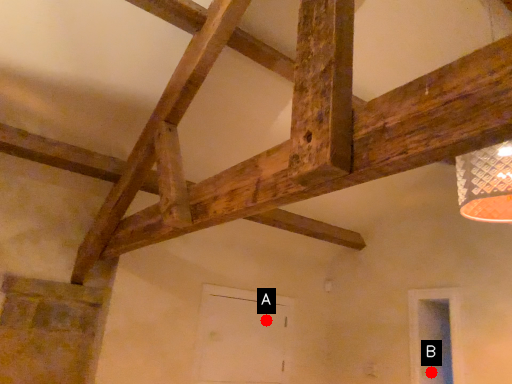
Question: Two points are circled on the image, labeled by A and B beside each circle. Among these points, which one is nearest to the camera?

Choices:
 (A) A is closer
 (B) B is closer

Answer: (B)